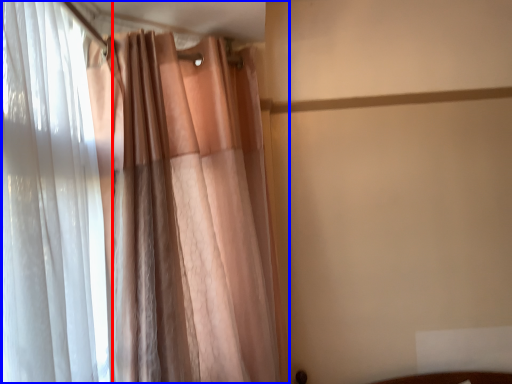
Question: Which of the following is the farthest to the observer, curtain (highlighted by a red box) or curtain (highlighted by a blue box)?

Choices:
 (A) curtain
 (B) curtain

Answer: (B)